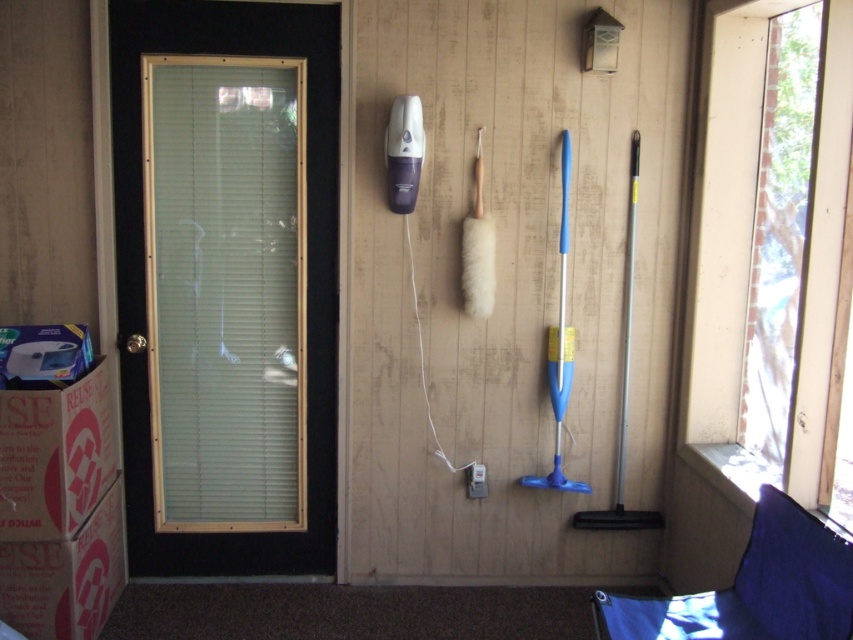
Does point (306, 51) come closer to viewer compared to point (57, 522)?

That is False.

Which of these two, black glass screen door at left or brown cardboard box at lower left, stands taller?

Standing taller between the two is black glass screen door at left.

Is point (328, 316) behind point (86, 477)?

Yes, it is behind point (86, 477).

Find the location of `black glass screen door at left`. black glass screen door at left is located at coordinates (306, 268).

Is brown cardboard box at lower left thinner than white cardboard box at lower left?

Indeed, brown cardboard box at lower left has a lesser width compared to white cardboard box at lower left.

Who is positioned more to the right, brown cardboard box at lower left or white cardboard box at lower left?

white cardboard box at lower left is more to the right.

Image resolution: width=853 pixels, height=640 pixels. Describe the element at coordinates (55, 456) in the screenshot. I see `brown cardboard box at lower left` at that location.

Identify the location of brown cardboard box at lower left. (55, 456).

Is black glass screen door at left positioned behind white cardboard box at lower left?

Yes, it is.

Locate an element on the screen. Image resolution: width=853 pixels, height=640 pixels. black glass screen door at left is located at coordinates (306, 268).

Image resolution: width=853 pixels, height=640 pixels. What are the coordinates of `black glass screen door at left` in the screenshot? It's located at (306, 268).